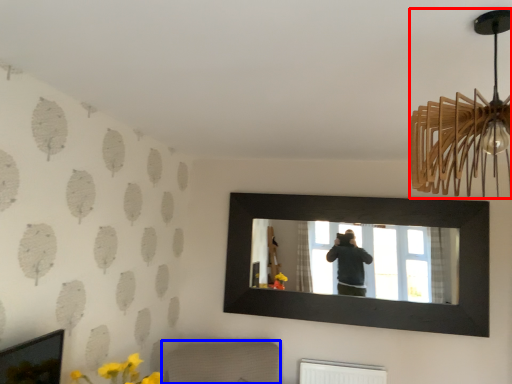
Question: Which object is closer to the camera taking this photo, lamp (highlighted by a red box) or furniture (highlighted by a blue box)?

Choices:
 (A) lamp
 (B) furniture

Answer: (A)